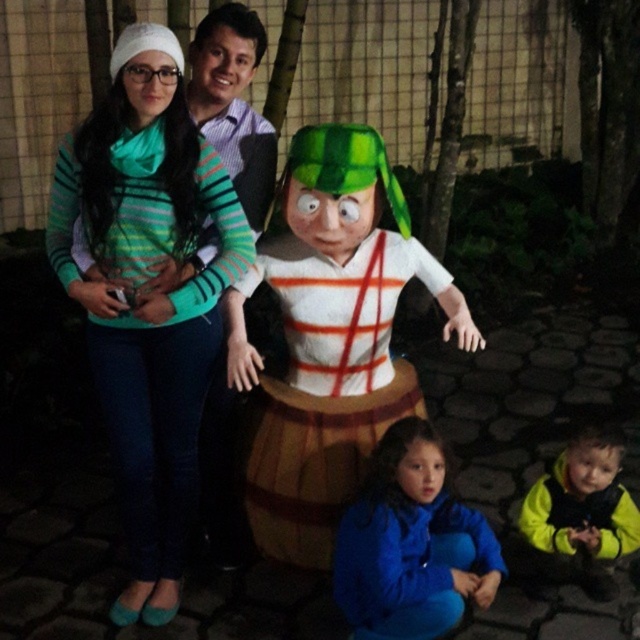
You are a photographer trying to focus on the green striped sweater at upper left. What coordinates should you adjust your camera to in order to capture it properly?

The green striped sweater at upper left is located at coordinates point (147, 296), so adjust your camera to those coordinates to capture it properly.

You are a photographer trying to capture a photo of the wooden barrel at center. You notice the green striped sweater at upper left is blocking your view. Can you move the sweater to the side so you can take the photo?

The green striped sweater at upper left is above the wooden barrel at center, so moving it to the side would allow you to take the photo without obstruction.

You are a photographer trying to capture a photo of the wooden barrel at center and the green striped sweater at upper left. Which object appears narrower in the photo?

The green striped sweater at upper left appears narrower than the wooden barrel at center because it is thinner.